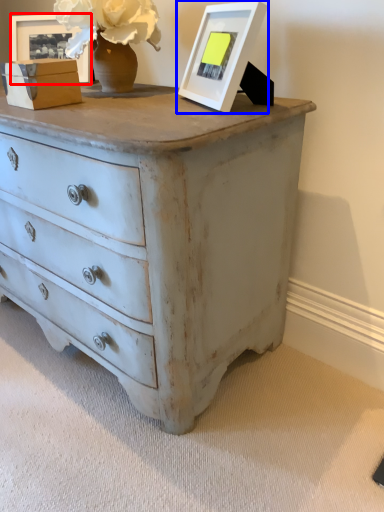
Question: Which of the following is the farthest to the observer, picture frame (highlighted by a red box) or picture frame (highlighted by a blue box)?

Choices:
 (A) picture frame
 (B) picture frame

Answer: (A)